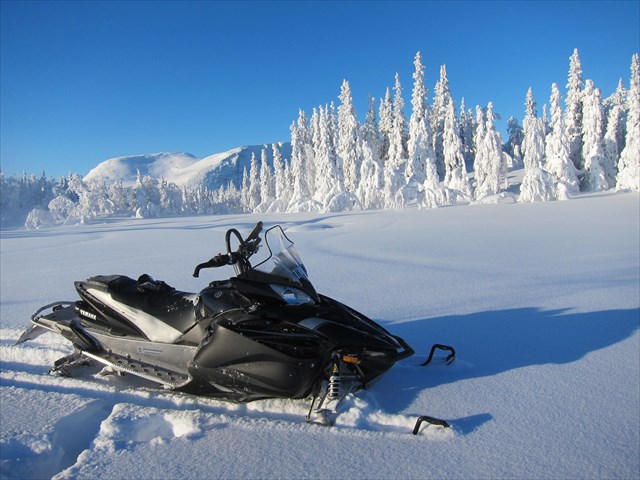
What are the coordinates of `seat` in the screenshot? It's located at (145, 294).